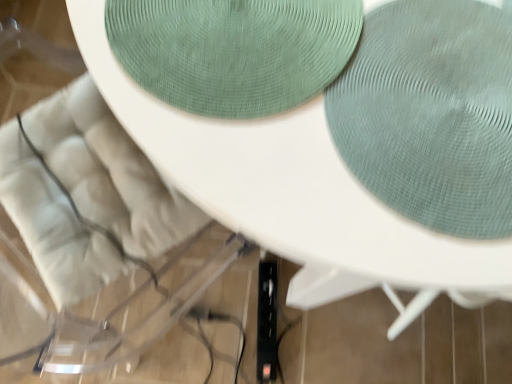
Question: From the image's perspective, does white fabric swivel chair at upper left appear higher than green textured placemat at upper center?

Choices:
 (A) no
 (B) yes

Answer: (A)

Question: Is white fabric swivel chair at upper left further to camera compared to green textured placemat at upper center?

Choices:
 (A) yes
 (B) no

Answer: (A)

Question: Is white fabric swivel chair at upper left smaller than green textured placemat at upper center?

Choices:
 (A) yes
 (B) no

Answer: (B)

Question: From the image's perspective, does white fabric swivel chair at upper left appear lower than green textured placemat at upper center?

Choices:
 (A) no
 (B) yes

Answer: (B)

Question: Does white fabric swivel chair at upper left have a lesser height compared to green textured placemat at upper center?

Choices:
 (A) yes
 (B) no

Answer: (B)

Question: Could you tell me if white fabric swivel chair at upper left is turned towards green textured placemat at upper center?

Choices:
 (A) no
 (B) yes

Answer: (A)

Question: Is the position of green textured placemat at upper center less distant than that of white fabric swivel chair at upper left?

Choices:
 (A) yes
 (B) no

Answer: (A)

Question: Does green textured placemat at upper center turn towards white fabric swivel chair at upper left?

Choices:
 (A) yes
 (B) no

Answer: (B)

Question: From a real-world perspective, is green textured placemat at upper center on white fabric swivel chair at upper left?

Choices:
 (A) yes
 (B) no

Answer: (A)

Question: Can you confirm if green textured placemat at upper center is thinner than white fabric swivel chair at upper left?

Choices:
 (A) yes
 (B) no

Answer: (A)

Question: From the image's perspective, is green textured placemat at upper center under white fabric swivel chair at upper left?

Choices:
 (A) no
 (B) yes

Answer: (A)

Question: Does green textured placemat at upper center have a lesser height compared to white fabric swivel chair at upper left?

Choices:
 (A) yes
 (B) no

Answer: (A)

Question: Is point (152, 182) closer or farther from the camera than point (346, 41)?

Choices:
 (A) farther
 (B) closer

Answer: (A)